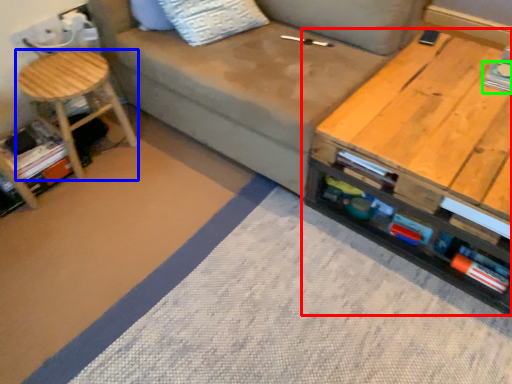
Question: Based on their relative distances, which object is farther from table (highlighted by a red box)? Choose from stool (highlighted by a blue box) and book (highlighted by a green box).

Choices:
 (A) stool
 (B) book

Answer: (A)